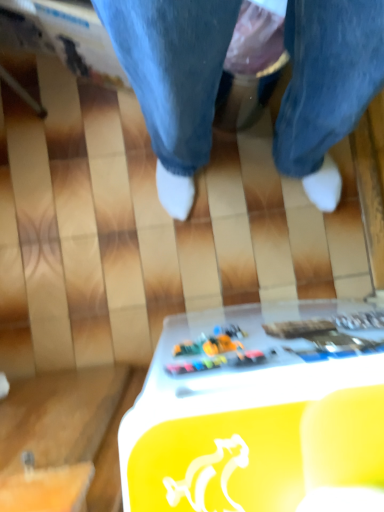
Measure the distance between point (x=371, y=314) and camera.

The distance of point (x=371, y=314) from camera is 20.12 inches.

Where is `white plastic table at lower center`? This screenshot has height=512, width=384. white plastic table at lower center is located at coordinates [256, 410].

Image resolution: width=384 pixels, height=512 pixels. Identify the location of metallic gold text at lower center, which appears as the first writing when viewed from the right. (x=361, y=320).

Would you say metallic gold text at lower center, which is counted as the 2th writing, starting from the left, contains white plastic table at lower center?

That's incorrect, white plastic table at lower center is not inside metallic gold text at lower center, which is counted as the 2th writing, starting from the left.

Is point (371, 327) behind point (184, 428)?

Yes, it is.

Is metallic gold text at lower center, which is counted as the 2th writing, starting from the left, not near white plastic table at lower center?

That's not correct — metallic gold text at lower center, which is counted as the 2th writing, starting from the left, is a little close to white plastic table at lower center.

Does white plastic table at lower center lie behind multicolored plastic toy at center, the second writing from the right?

No, the depth of white plastic table at lower center is less than that of multicolored plastic toy at center, the second writing from the right.

Who is shorter, white plastic table at lower center or multicolored plastic toy at center, the second writing from the right?

multicolored plastic toy at center, the second writing from the right.

From the image's perspective, does white plastic table at lower center appear higher than multicolored plastic toy at center, the second writing from the right?

No, from the image's perspective, white plastic table at lower center is not on top of multicolored plastic toy at center, the second writing from the right.

Measure the distance between white plastic table at lower center and multicolored plastic toy at center, which is the 1th writing from left to right.

The distance of white plastic table at lower center from multicolored plastic toy at center, which is the 1th writing from left to right, is 2.65 centimeters.

From the image's perspective, between multicolored plastic toy at center, the second writing from the right, and metallic gold text at lower center, which is counted as the 2th writing, starting from the left, who is located below?

multicolored plastic toy at center, the second writing from the right, appears lower in the image.

Looking at this image, is multicolored plastic toy at center, the second writing from the right, positioned behind metallic gold text at lower center, which is counted as the 2th writing, starting from the left?

No, multicolored plastic toy at center, the second writing from the right, is closer to the viewer.

Does multicolored plastic toy at center, the second writing from the right, have a lesser height compared to metallic gold text at lower center, which appears as the first writing when viewed from the right?

Incorrect, the height of multicolored plastic toy at center, the second writing from the right, does not fall short of that of metallic gold text at lower center, which appears as the first writing when viewed from the right.

Can you tell me how much multicolored plastic toy at center, which is the 1th writing from left to right, and metallic gold text at lower center, which is counted as the 2th writing, starting from the left, differ in facing direction?

The angular difference between multicolored plastic toy at center, which is the 1th writing from left to right, and metallic gold text at lower center, which is counted as the 2th writing, starting from the left, is 5.14 degrees.

Is multicolored plastic toy at center, the second writing from the right, at the right side of white plastic table at lower center?

No.

Who is more distant, multicolored plastic toy at center, which is the 1th writing from left to right, or white plastic table at lower center?

multicolored plastic toy at center, which is the 1th writing from left to right, is behind.

What's the angular difference between multicolored plastic toy at center, which is the 1th writing from left to right, and white plastic table at lower center's facing directions?

There is a 3.98-degree angle between the facing directions of multicolored plastic toy at center, which is the 1th writing from left to right, and white plastic table at lower center.

Considering the positions of point (218, 337) and point (250, 503), is point (218, 337) closer or farther from the camera than point (250, 503)?

Point (218, 337) is farther from the camera than point (250, 503).

Considering the relative sizes of metallic gold text at lower center, which is counted as the 2th writing, starting from the left, and multicolored plastic toy at center, which is the 1th writing from left to right, in the image provided, is metallic gold text at lower center, which is counted as the 2th writing, starting from the left, wider than multicolored plastic toy at center, which is the 1th writing from left to right,?

Incorrect, the width of metallic gold text at lower center, which is counted as the 2th writing, starting from the left, does not surpass that of multicolored plastic toy at center, which is the 1th writing from left to right.

How different are the orientations of metallic gold text at lower center, which is counted as the 2th writing, starting from the left, and multicolored plastic toy at center, the second writing from the right, in degrees?

5.14 degrees.

Identify the location of writing lying below the metallic gold text at lower center, which appears as the first writing when viewed from the right (from the image's perspective). (329, 333).

Who is smaller, metallic gold text at lower center, which is counted as the 2th writing, starting from the left, or multicolored plastic toy at center, which is the 1th writing from left to right?

Smaller between the two is metallic gold text at lower center, which is counted as the 2th writing, starting from the left.

Looking at their sizes, would you say white plastic table at lower center is wider or thinner than metallic gold text at lower center, which appears as the first writing when viewed from the right?

Considering their sizes, white plastic table at lower center looks broader than metallic gold text at lower center, which appears as the first writing when viewed from the right.

Does point (230, 477) appear closer or farther from the camera than point (381, 314)?

Point (230, 477) is closer to the camera than point (381, 314).

Between white plastic table at lower center and metallic gold text at lower center, which is counted as the 2th writing, starting from the left, which one has smaller size?

Smaller between the two is metallic gold text at lower center, which is counted as the 2th writing, starting from the left.

Is white plastic table at lower center at the left side of metallic gold text at lower center, which is counted as the 2th writing, starting from the left?

No.

From a real-world perspective, which writing is the 1st one above the white plastic table at lower center? Please provide its 2D coordinates.

[(361, 320)]

I want to click on table that appears in front of the multicolored plastic toy at center, which is the 1th writing from left to right, so click(x=256, y=410).

Estimate the real-world distances between objects in this image. Which object is further from white plastic table at lower center, metallic gold text at lower center, which is counted as the 2th writing, starting from the left, or multicolored plastic toy at center, the second writing from the right?

metallic gold text at lower center, which is counted as the 2th writing, starting from the left, is positioned further to the anchor white plastic table at lower center.

Consider the image. Considering their positions, is white plastic table at lower center positioned closer to multicolored plastic toy at center, the second writing from the right, than metallic gold text at lower center, which is counted as the 2th writing, starting from the left?

white plastic table at lower center is positioned closer to the anchor multicolored plastic toy at center, the second writing from the right.

Looking at the image, which one is located closer to multicolored plastic toy at center, the second writing from the right, metallic gold text at lower center, which appears as the first writing when viewed from the right, or white plastic table at lower center?

Among the two, white plastic table at lower center is located nearer to multicolored plastic toy at center, the second writing from the right.

From the picture: From the image, which object appears to be nearer to metallic gold text at lower center, which is counted as the 2th writing, starting from the left, white plastic table at lower center or multicolored plastic toy at center, the second writing from the right?

multicolored plastic toy at center, the second writing from the right.

When comparing their distances from white plastic table at lower center, does multicolored plastic toy at center, the second writing from the right, or metallic gold text at lower center, which is counted as the 2th writing, starting from the left, seem further?

metallic gold text at lower center, which is counted as the 2th writing, starting from the left.

From the image, which object appears to be farther from metallic gold text at lower center, which is counted as the 2th writing, starting from the left, multicolored plastic toy at center, which is the 1th writing from left to right, or white plastic table at lower center?

white plastic table at lower center lies further to metallic gold text at lower center, which is counted as the 2th writing, starting from the left, than the other object.

You are a GUI agent. You are given a task and a screenshot of the screen. Output one action in this format:
    pyautogui.click(x=<x>, y=<y>)
    Task: Click on the writing between metallic gold text at lower center, which appears as the first writing when viewed from the right, and white plastic table at lower center vertically
    
    Given the screenshot: What is the action you would take?
    pyautogui.click(x=329, y=333)